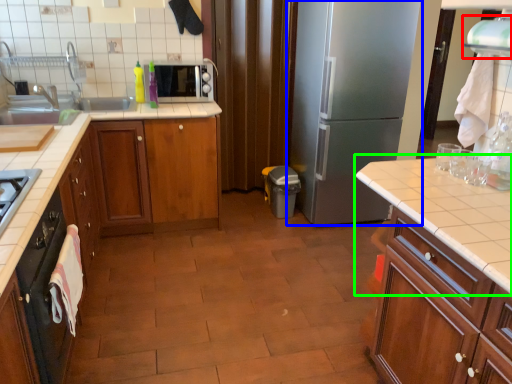
Question: Considering the real-world distances, which object is farthest from exhaust hood (highlighted by a red box)? refrigerator (highlighted by a blue box) or countertop (highlighted by a green box)?

Choices:
 (A) refrigerator
 (B) countertop

Answer: (A)